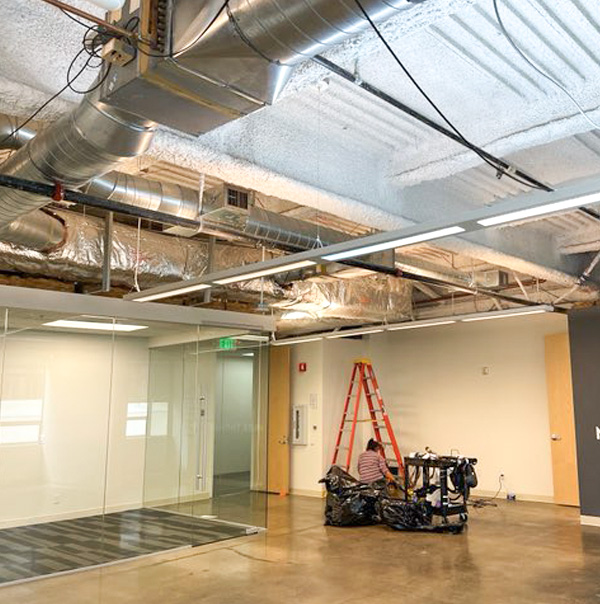
Locate an element on the screen. This screenshot has width=600, height=604. wall is located at coordinates (438, 406).